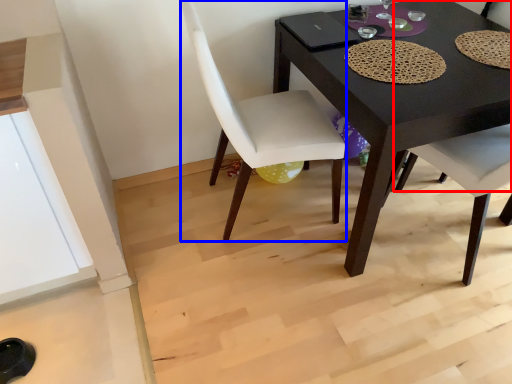
Question: Which point is closer to the camera, chair (highlighted by a red box) or chair (highlighted by a blue box)?

Choices:
 (A) chair
 (B) chair

Answer: (B)